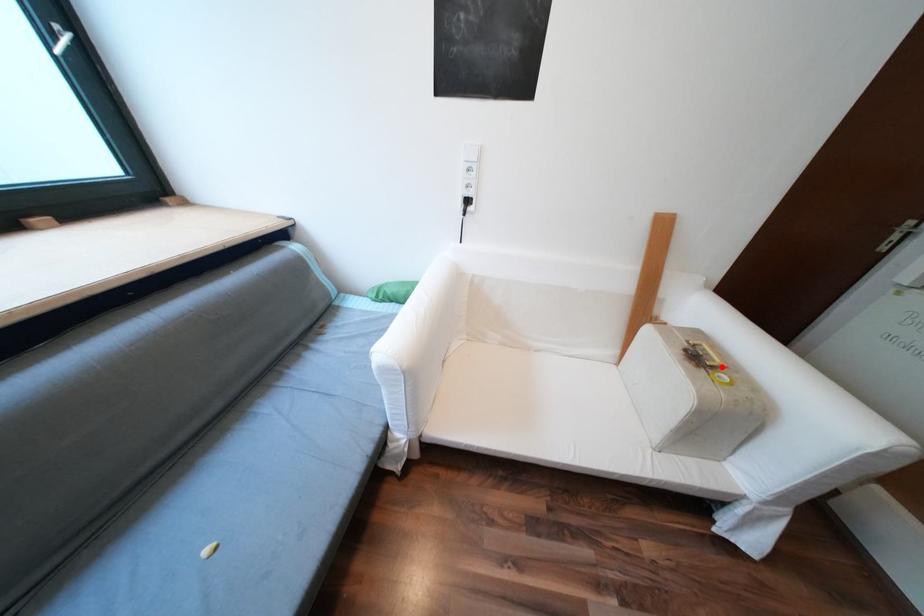
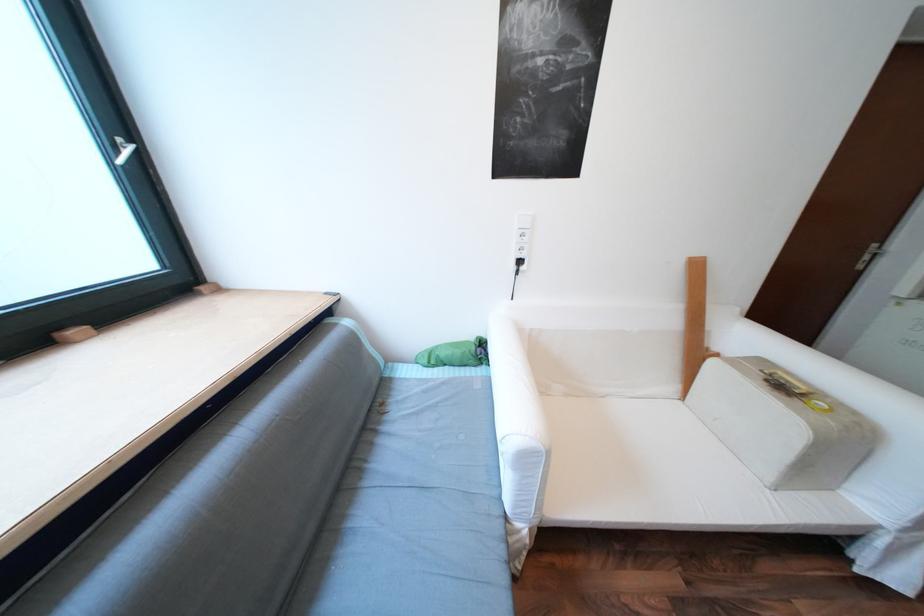
In the second image, find the point that corresponds to the highlighted location in the first image.

(811, 394)